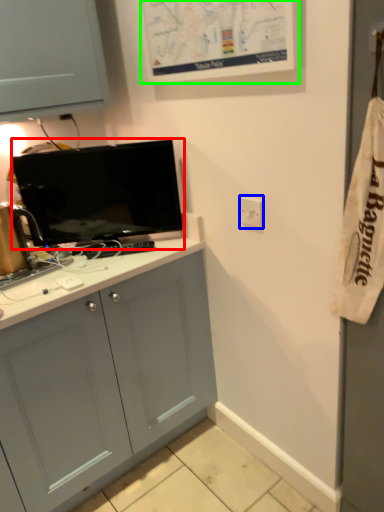
Question: Which object is positioned farthest from television (highlighted by a red box)? Select from electric outlet (highlighted by a blue box) and bulletin board (highlighted by a green box).

Choices:
 (A) electric outlet
 (B) bulletin board

Answer: (A)